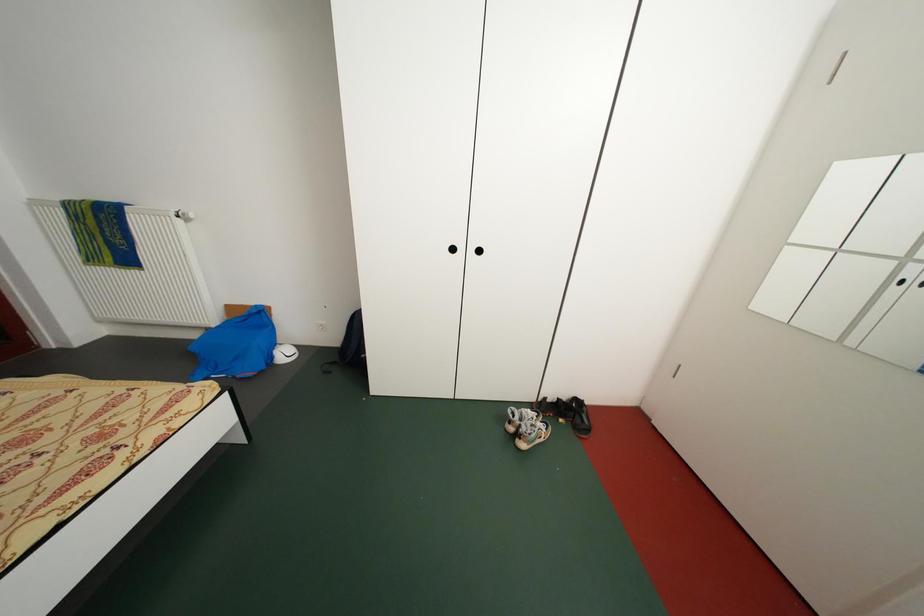
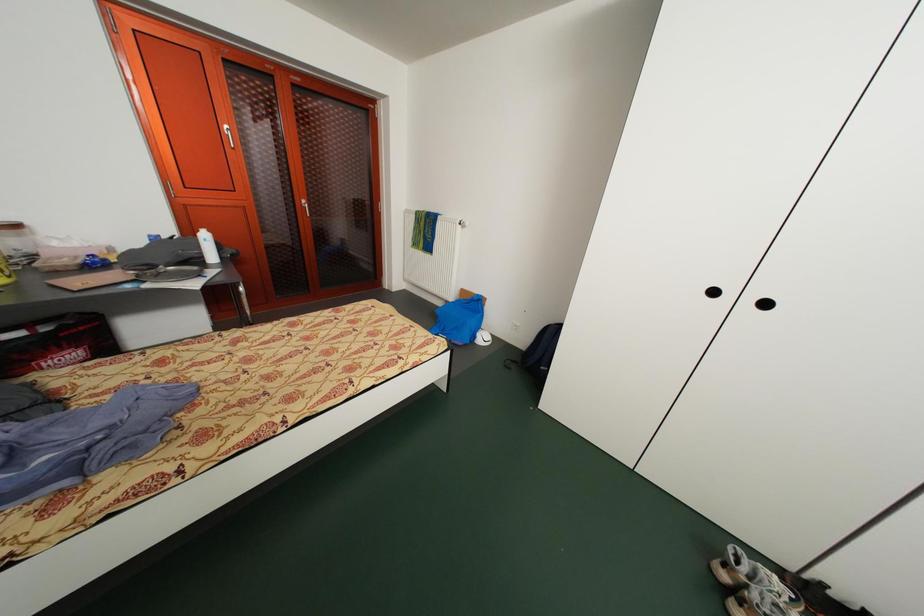
Question: The images are taken continuously from a first-person perspective. In which direction is your viewpoint rotating?

Choices:
 (A) Left
 (B) Right
 (C) Up
 (D) Down

Answer: (A)